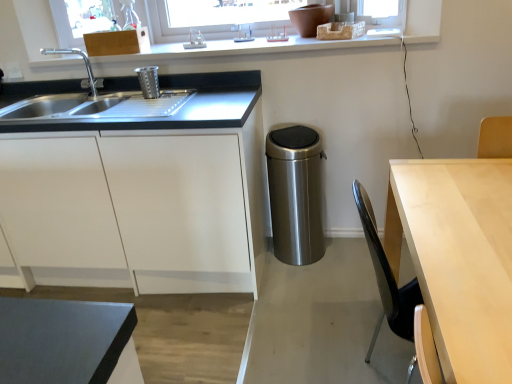
Question: Does white matte cabinet at left, the 1th cabinetry positioned from the bottom, have a lesser width compared to white plastic window frame at upper center?

Choices:
 (A) yes
 (B) no

Answer: (B)

Question: Is white matte cabinet at left, the second cabinetry viewed from the top, with white plastic window frame at upper center?

Choices:
 (A) yes
 (B) no

Answer: (B)

Question: Can you confirm if white matte cabinet at left, the second cabinetry viewed from the top, is taller than white plastic window frame at upper center?

Choices:
 (A) yes
 (B) no

Answer: (A)

Question: From the image's perspective, is white matte cabinet at left, the second cabinetry viewed from the top, on top of white plastic window frame at upper center?

Choices:
 (A) yes
 (B) no

Answer: (B)

Question: From a real-world perspective, is white matte cabinet at left, the 1th cabinetry positioned from the bottom, beneath white plastic window frame at upper center?

Choices:
 (A) no
 (B) yes

Answer: (B)

Question: From the image's perspective, does white matte cabinet at left, the second cabinetry viewed from the top, appear lower than white plastic window frame at upper center?

Choices:
 (A) yes
 (B) no

Answer: (A)

Question: Can you confirm if brushed metal faucet at left is wider than light wood table at right?

Choices:
 (A) yes
 (B) no

Answer: (B)

Question: Is brushed metal faucet at left bigger than light wood table at right?

Choices:
 (A) no
 (B) yes

Answer: (A)

Question: Is the position of brushed metal faucet at left less distant than that of light wood table at right?

Choices:
 (A) no
 (B) yes

Answer: (A)

Question: Is brushed metal faucet at left at the right side of light wood table at right?

Choices:
 (A) yes
 (B) no

Answer: (B)

Question: From the image's perspective, does brushed metal faucet at left appear higher than light wood table at right?

Choices:
 (A) yes
 (B) no

Answer: (A)

Question: Is brushed metal faucet at left completely or partially outside of light wood table at right?

Choices:
 (A) yes
 (B) no

Answer: (A)

Question: Is white plastic window frame at upper center far away from brushed metal trash can at upper left, which is the second appliance in right-to-left order?

Choices:
 (A) yes
 (B) no

Answer: (B)